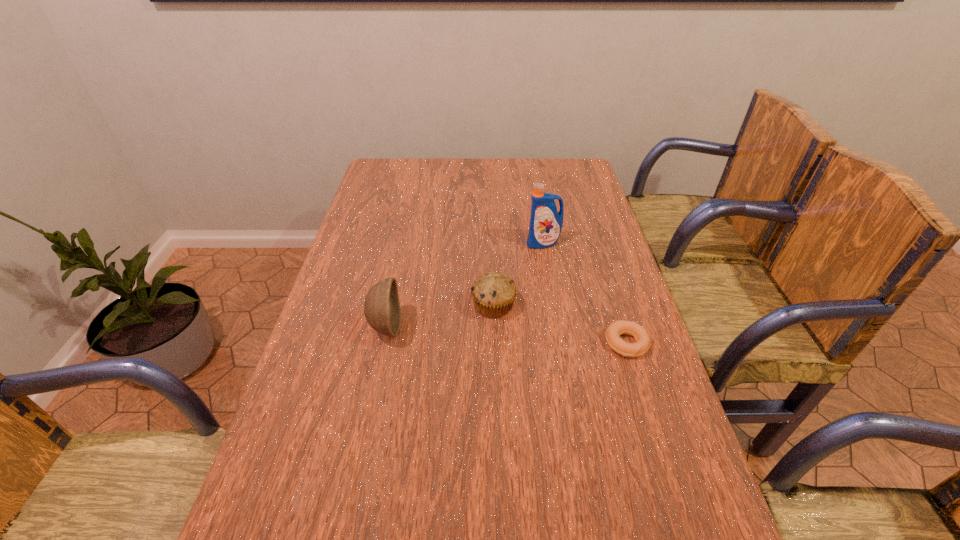
The height and width of the screenshot is (540, 960). I want to click on empty space between the rightmost object and the tallest object, so click(x=585, y=293).

Find the location of `unoccupied area between the tallest object and the bowl`. unoccupied area between the tallest object and the bowl is located at coordinates (465, 285).

Locate an element on the screen. The height and width of the screenshot is (540, 960). vacant area between the detergent and the second shortest object is located at coordinates (518, 274).

Where is `free spot between the bagel and the bowl`? free spot between the bagel and the bowl is located at coordinates (506, 335).

At what (x,y) coordinates should I click in order to perform the action: click on unoccupied area between the rightmost object and the bowl. Please return your answer as a coordinate pair (x, y). The height and width of the screenshot is (540, 960). Looking at the image, I should click on (506, 335).

Where is `free spot between the rightmost object and the bowl`? Image resolution: width=960 pixels, height=540 pixels. free spot between the rightmost object and the bowl is located at coordinates (506, 335).

The image size is (960, 540). What are the coordinates of `empty space that is in between the bagel and the second object from right to left` in the screenshot? It's located at (585, 293).

Select which object appears as the third closest to the bowl. Please provide its 2D coordinates. Your answer should be formatted as a tuple, i.e. [(x, y)], where the tuple contains the x and y coordinates of a point satisfying the conditions above.

[(643, 341)]

I want to click on object that can be found as the third closest to the muffin, so click(x=643, y=341).

Identify the location of vacant position in the image that satisfies the following two spatial constraints: 1. on the back side of the muffin; 2. on the right side of the second tallest object. (391, 305).